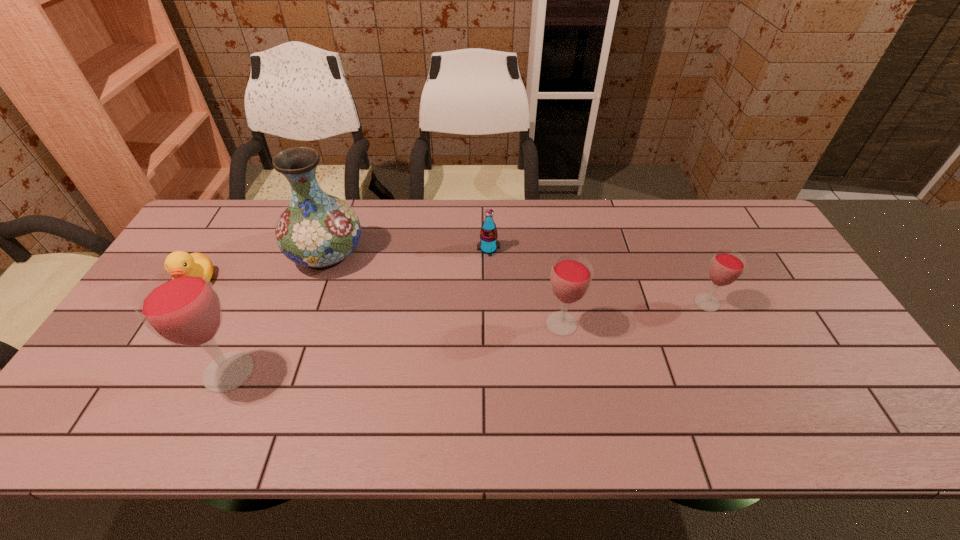
The height and width of the screenshot is (540, 960). In the image, there is a desktop. Find the location of `blank space at the far edge`. blank space at the far edge is located at coordinates (402, 214).

In the image, there is a desktop. What are the coordinates of `vacant space at the near edge` in the screenshot? It's located at (258, 383).

In the image, there is a desktop. Identify the location of free space at the right edge. (810, 354).

Identify the location of vacant area that lies between the vase and the soda. This screenshot has width=960, height=540. (407, 251).

This screenshot has height=540, width=960. Find the location of `unoccupied position between the vase and the rightmost object`. unoccupied position between the vase and the rightmost object is located at coordinates (516, 278).

Identify the location of free point between the rightmost object and the vase. (516, 278).

Where is `unoccupied position between the fourth shortest object and the shortest object`? unoccupied position between the fourth shortest object and the shortest object is located at coordinates (379, 303).

You are a GUI agent. You are given a task and a screenshot of the screen. Output one action in this format:
    pyautogui.click(x=<x>, y=<y>)
    Task: Click on the unoccupied area between the rightmost object and the tallest wineglass
    This screenshot has width=960, height=540.
    Given the screenshot: What is the action you would take?
    pyautogui.click(x=468, y=338)

Locate an element on the screen. vacant space that's between the nearest object and the shortest wineglass is located at coordinates (468, 338).

Find the location of a particular element. The image size is (960, 540). free space between the soda and the vase is located at coordinates (407, 251).